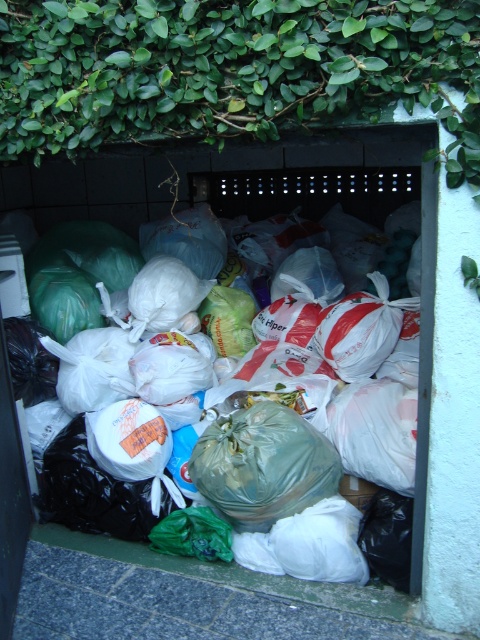
Consider the image. You are standing at the edge of the gray concrete pavement at lower left and want to throw a piece of trash into the translucent plastic bags at center. Can you reach them without stepping off the pavement?

The gray concrete pavement at lower left is closer to the viewer than the translucent plastic bags at center, so you would need to step forward from the pavement to reach the bags, which are further away.

You are a delivery robot with a package that needs to be placed on the gray concrete pavement at lower left. The translucent plastic bags at center are blocking your path. Can you navigate around them to reach the pavement?

The distance between the gray concrete pavement at lower left and the translucent plastic bags at center is 22.38 inches. Since the robot needs to place the package on the pavement, it can navigate around the bags as the distance allows sufficient space for maneuvering.